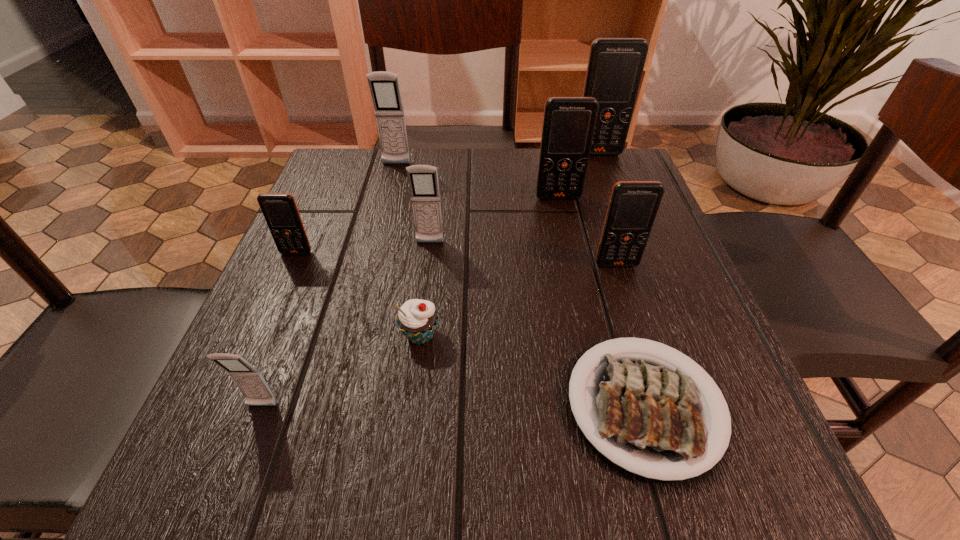
This screenshot has height=540, width=960. I want to click on free location located on the screen of the sixth farthest object, so click(x=671, y=434).

Where is `free space located on the screen of the second nearest orange cellular telephone`? free space located on the screen of the second nearest orange cellular telephone is located at coordinates (238, 384).

Where is `vacant space situated 0.050m on the front-facing side of the leftmost gray cellular telephone`? Image resolution: width=960 pixels, height=540 pixels. vacant space situated 0.050m on the front-facing side of the leftmost gray cellular telephone is located at coordinates (247, 447).

Identify the location of vacant area situated 0.200m on the front of the cupcake. The image size is (960, 540). (402, 487).

Find the location of `free location located on the left of the shortest object`. free location located on the left of the shortest object is located at coordinates (434, 406).

The height and width of the screenshot is (540, 960). Identify the location of object located in the near edge section of the desktop. (651, 416).

At what (x,y) coordinates should I click in order to perform the action: click on plate present at the right edge. Please return your answer as a coordinate pair (x, y). The height and width of the screenshot is (540, 960). Looking at the image, I should click on (651, 416).

In order to click on object that is at the far left corner in this screenshot , I will do `click(384, 86)`.

Identify the location of object that is at the near right corner. (651, 416).

In the image, there is a desktop. In order to click on vacant space at the far edge in this screenshot , I will do `click(447, 164)`.